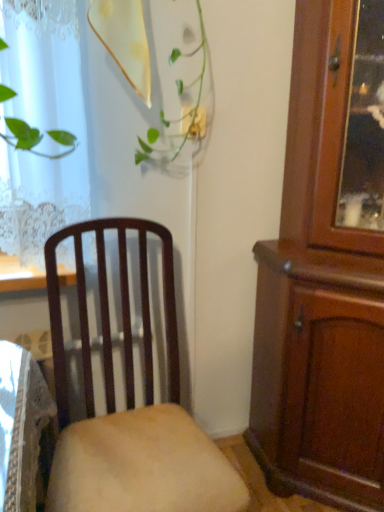
Question: Considering the relative sizes of mahogany wood cabinet at right and matte wood chair at center in the image provided, is mahogany wood cabinet at right taller than matte wood chair at center?

Choices:
 (A) no
 (B) yes

Answer: (B)

Question: Is mahogany wood cabinet at right with matte wood chair at center?

Choices:
 (A) yes
 (B) no

Answer: (B)

Question: Can you confirm if mahogany wood cabinet at right is shorter than matte wood chair at center?

Choices:
 (A) yes
 (B) no

Answer: (B)

Question: Does mahogany wood cabinet at right have a larger size compared to matte wood chair at center?

Choices:
 (A) no
 (B) yes

Answer: (B)

Question: Does mahogany wood cabinet at right appear on the right side of matte wood chair at center?

Choices:
 (A) no
 (B) yes

Answer: (B)

Question: Is mahogany wood cabinet at right not inside matte wood chair at center?

Choices:
 (A) no
 (B) yes

Answer: (B)

Question: From a real-world perspective, is matte wood chair at center physically above mahogany wood cabinet at right?

Choices:
 (A) no
 (B) yes

Answer: (A)

Question: Does matte wood chair at center have a smaller size compared to mahogany wood cabinet at right?

Choices:
 (A) no
 (B) yes

Answer: (B)

Question: Is mahogany wood cabinet at right surrounded by matte wood chair at center?

Choices:
 (A) no
 (B) yes

Answer: (A)

Question: Is matte wood chair at center positioned with its back to mahogany wood cabinet at right?

Choices:
 (A) yes
 (B) no

Answer: (B)

Question: Is matte wood chair at center to the right of mahogany wood cabinet at right from the viewer's perspective?

Choices:
 (A) no
 (B) yes

Answer: (A)

Question: Considering the relative positions of matte wood chair at center and mahogany wood cabinet at right in the image provided, is matte wood chair at center in front of mahogany wood cabinet at right?

Choices:
 (A) yes
 (B) no

Answer: (A)

Question: Is mahogany wood cabinet at right taller or shorter than matte wood chair at center?

Choices:
 (A) tall
 (B) short

Answer: (A)